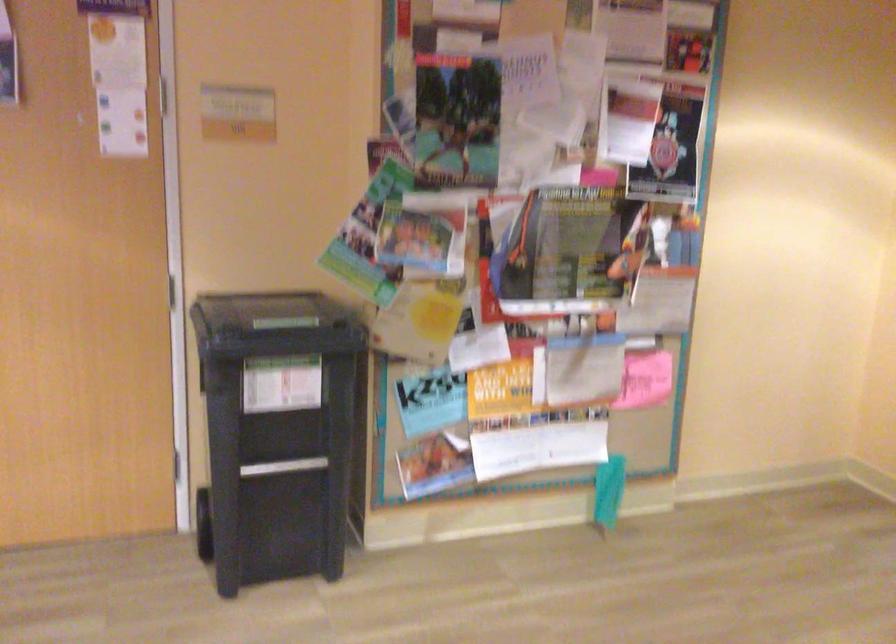
I want to click on black trash can lid, so click(x=273, y=325).